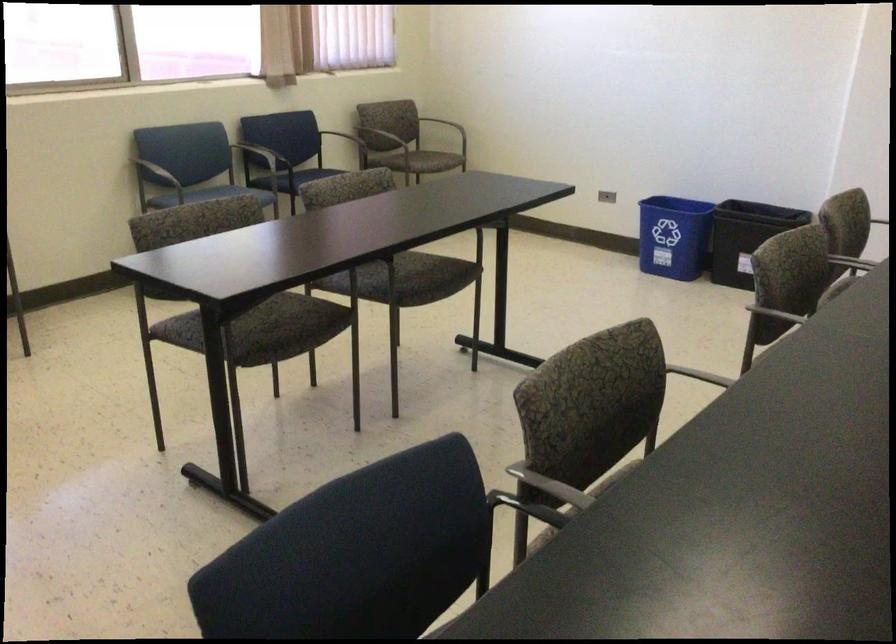
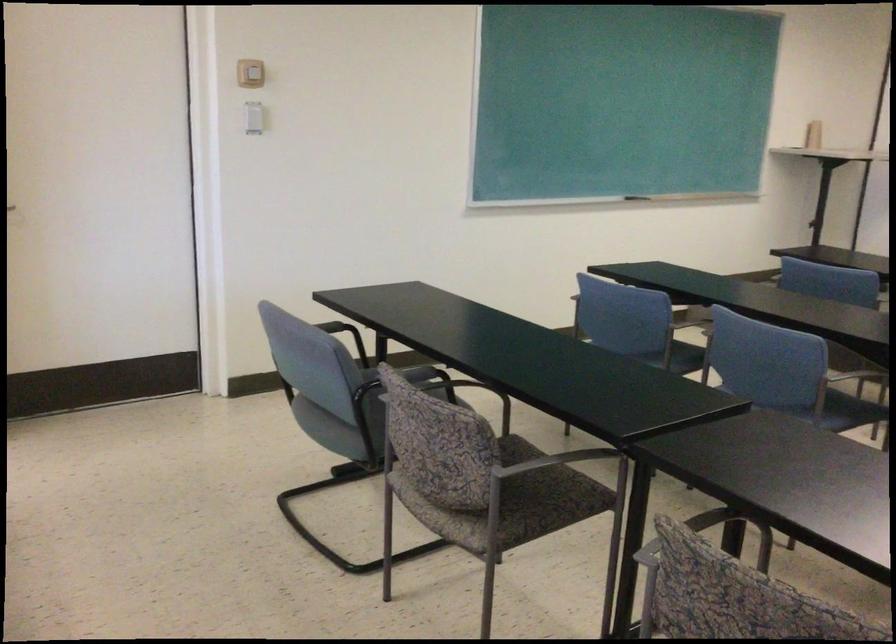
First-person continuous shooting, in which direction is the camera rotating?

The rotation direction of the camera is right-down.